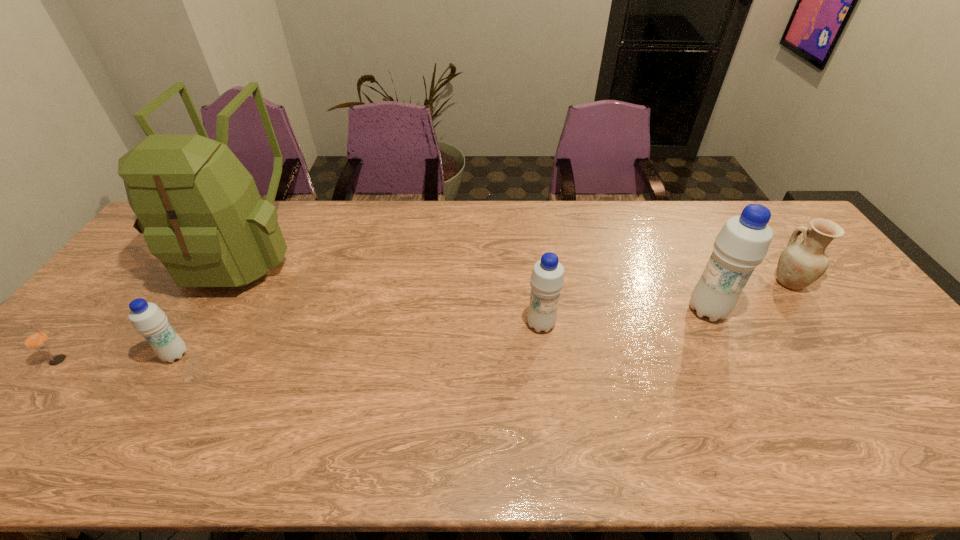
Find the location of `free point located on the back of the nearest water bottle`. free point located on the back of the nearest water bottle is located at coordinates (239, 250).

Where is `free region located 0.170m on the back of the fourth shortest object`? This screenshot has height=540, width=960. free region located 0.170m on the back of the fourth shortest object is located at coordinates (534, 271).

What are the coordinates of `vacant region located 0.340m on the left of the fifth object from left to right` in the screenshot? It's located at (566, 310).

Where is `blank space located 0.090m on the front pocket of the tallest object`? Image resolution: width=960 pixels, height=540 pixels. blank space located 0.090m on the front pocket of the tallest object is located at coordinates (200, 326).

Locate an element on the screen. vacant area situated on the front of the pottery is located at coordinates (825, 332).

Where is `free location located on the right of the leftmost object`? The height and width of the screenshot is (540, 960). free location located on the right of the leftmost object is located at coordinates pos(224,360).

This screenshot has height=540, width=960. I want to click on object that is at the far edge, so click(x=199, y=209).

Where is `backpack present at the left edge`? The height and width of the screenshot is (540, 960). backpack present at the left edge is located at coordinates (199, 209).

Find the location of a particular element. The width and height of the screenshot is (960, 540). straw that is at the left edge is located at coordinates (36, 339).

Where is `object situated at the right edge`? object situated at the right edge is located at coordinates (800, 264).